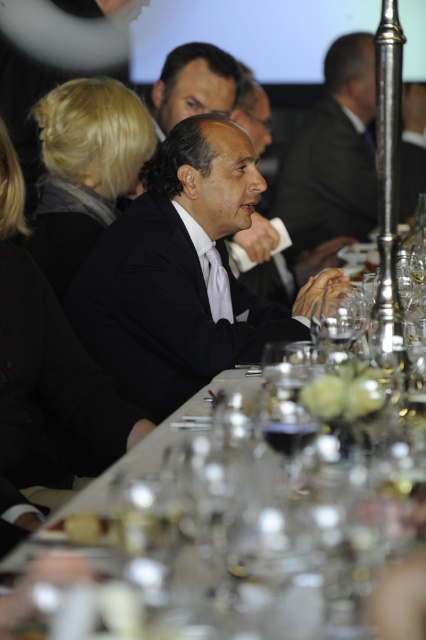
Does matte black suit at center have a lesser width compared to transparent glass wine glass at center?

Incorrect, matte black suit at center's width is not less than transparent glass wine glass at center's.

Is point (328, 51) positioned in front of point (287, 406)?

No, (328, 51) is behind (287, 406).

Identify the location of matte black suit at center. (333, 157).

Is point (184, 586) farther from camera compared to point (342, 136)?

No, (184, 586) is in front of (342, 136).

Where is `clear glass table at center`? The width and height of the screenshot is (426, 640). clear glass table at center is located at coordinates (255, 518).

Is point (161, 452) positioned in front of point (367, 216)?

Yes.

Where is `clear glass table at center`? This screenshot has height=640, width=426. clear glass table at center is located at coordinates (255, 518).

Does black satin suit at center have a smaller size compared to transparent glass wine glass at center?

No, black satin suit at center is not smaller than transparent glass wine glass at center.

Does black satin suit at center lie in front of transparent glass wine glass at center?

No, it is behind transparent glass wine glass at center.

The image size is (426, 640). Find the location of `black satin suit at center`. black satin suit at center is located at coordinates (164, 310).

The height and width of the screenshot is (640, 426). Identify the location of black satin suit at center. (164, 310).